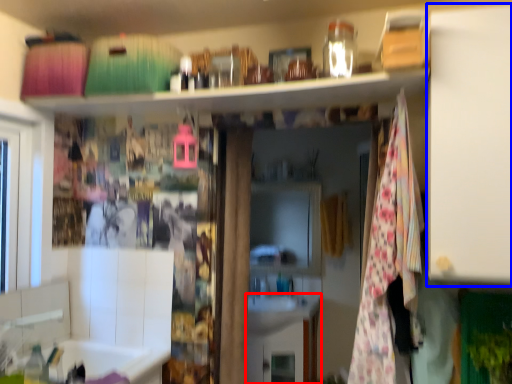
Question: Which object appears closest to the camera in this image, cabinetry (highlighted by a red box) or cabinet (highlighted by a blue box)?

Choices:
 (A) cabinetry
 (B) cabinet

Answer: (B)